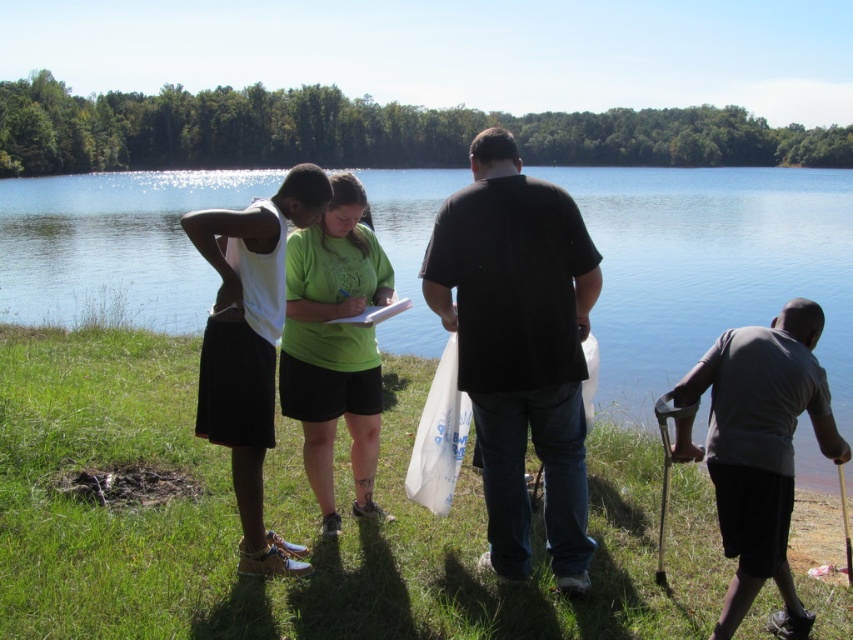
Does transparent water at center lie in front of black matte shirt at center?

No.

Which of these two, transparent water at center or black matte shirt at center, stands shorter?

black matte shirt at center is shorter.

The width and height of the screenshot is (853, 640). What do you see at coordinates (711, 268) in the screenshot? I see `transparent water at center` at bounding box center [711, 268].

At what (x,y) coordinates should I click in order to perform the action: click on transparent water at center. Please return your answer as a coordinate pair (x, y). The height and width of the screenshot is (640, 853). Looking at the image, I should click on (711, 268).

Find the location of a particular element. The image size is (853, 640). transparent water at center is located at coordinates (711, 268).

Between point (155, 308) and point (749, 365), which one is positioned in front?

Point (749, 365) is more forward.

This screenshot has width=853, height=640. I want to click on transparent water at center, so click(711, 268).

Is point (735, 582) positioned after point (347, 342)?

No.

Which is more to the left, gray fabric shirt at lower right or green matte shirt at center?

Positioned to the left is green matte shirt at center.

Between point (828, 442) and point (309, 227), which one is positioned behind?

Point (309, 227)

This screenshot has height=640, width=853. Find the location of `gray fabric shirt at lower right`. gray fabric shirt at lower right is located at coordinates (759, 451).